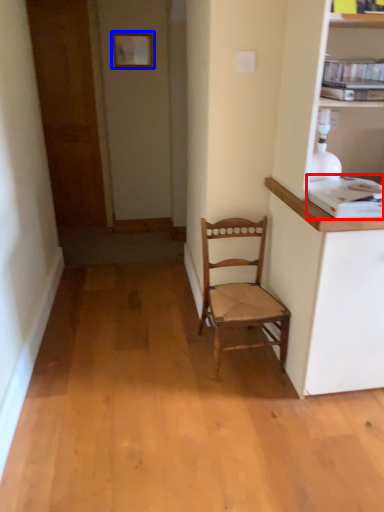
Question: Which point is closer to the camera, appliance (highlighted by a red box) or picture frame (highlighted by a blue box)?

Choices:
 (A) appliance
 (B) picture frame

Answer: (A)